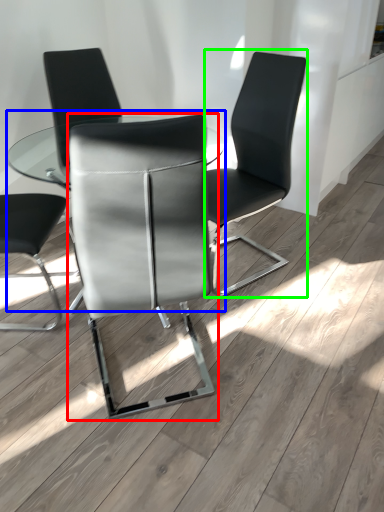
Question: Which object is positioned closest to chair (highlighted by a red box)? Select from table (highlighted by a blue box) and chair (highlighted by a green box).

Choices:
 (A) table
 (B) chair

Answer: (B)